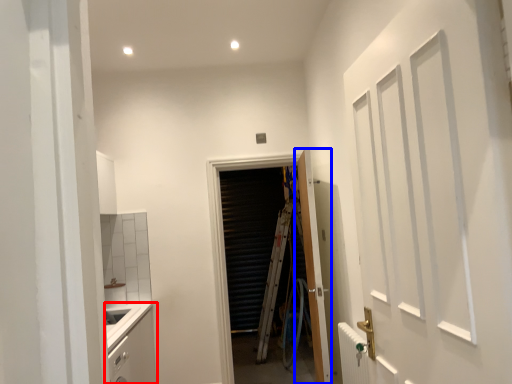
Question: Which object appears farthest to the camera in this image, cabinetry (highlighted by a red box) or door (highlighted by a blue box)?

Choices:
 (A) cabinetry
 (B) door

Answer: (B)